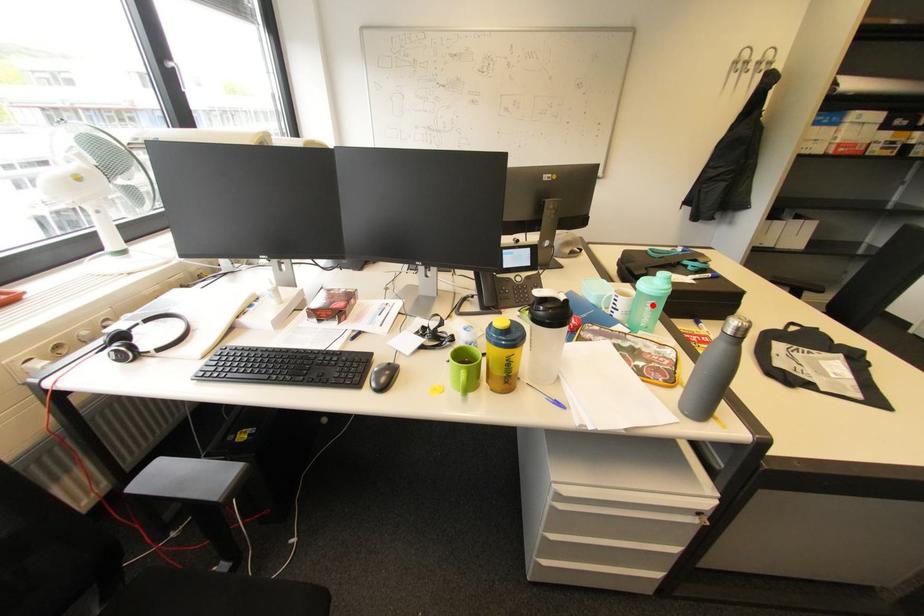
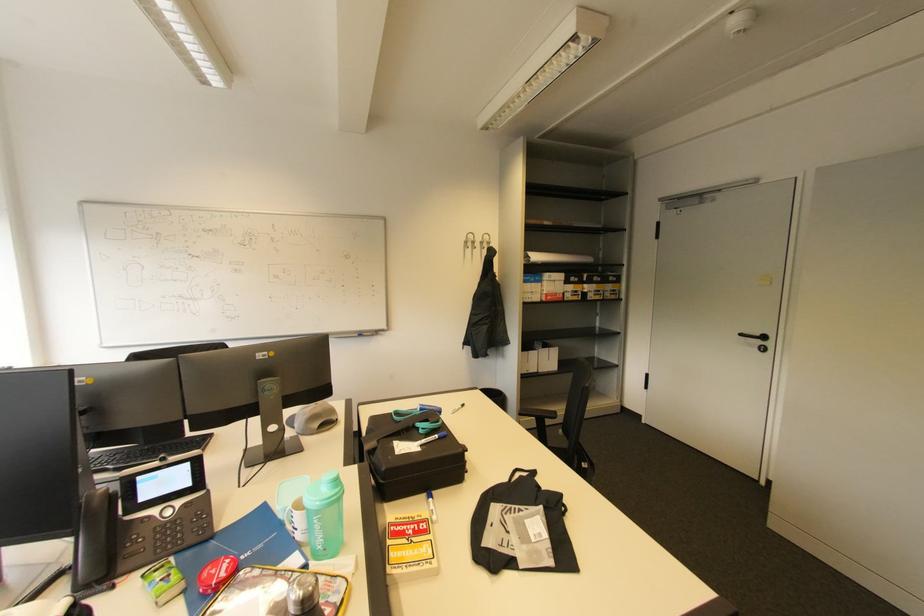
Find the pixel in the second image that matches the highlighted location in the first image.

(320, 522)